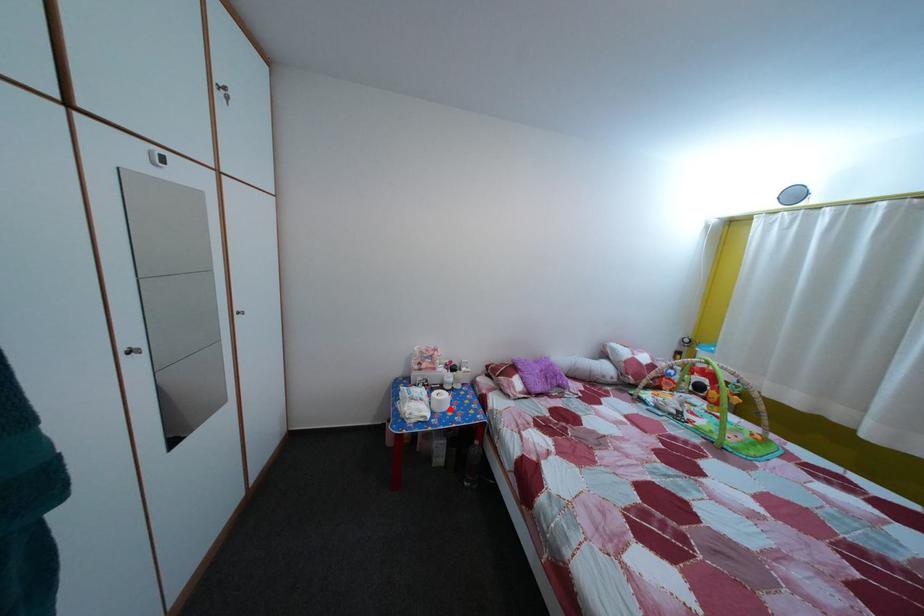
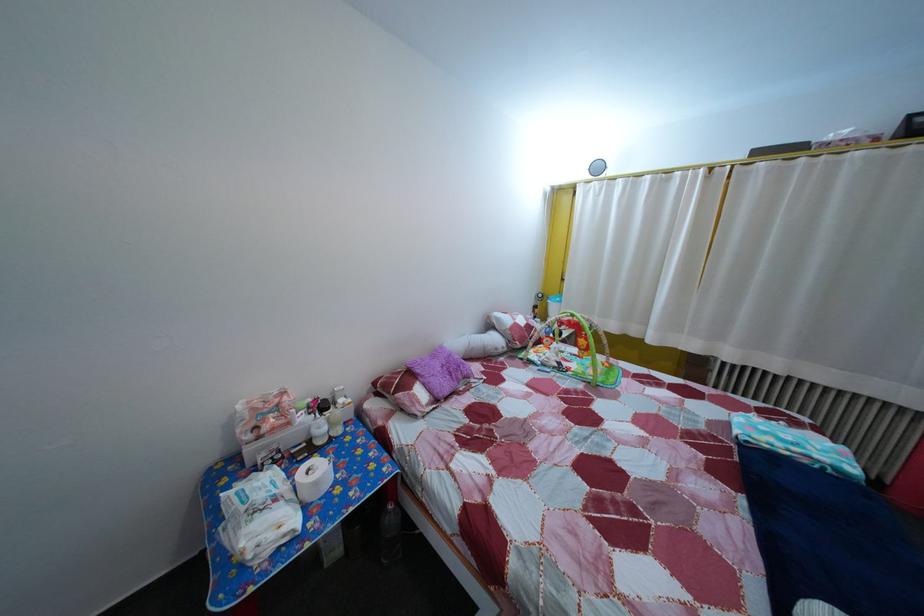
In the second image, find the point that corresponds to the highlighted location in the first image.

(325, 491)